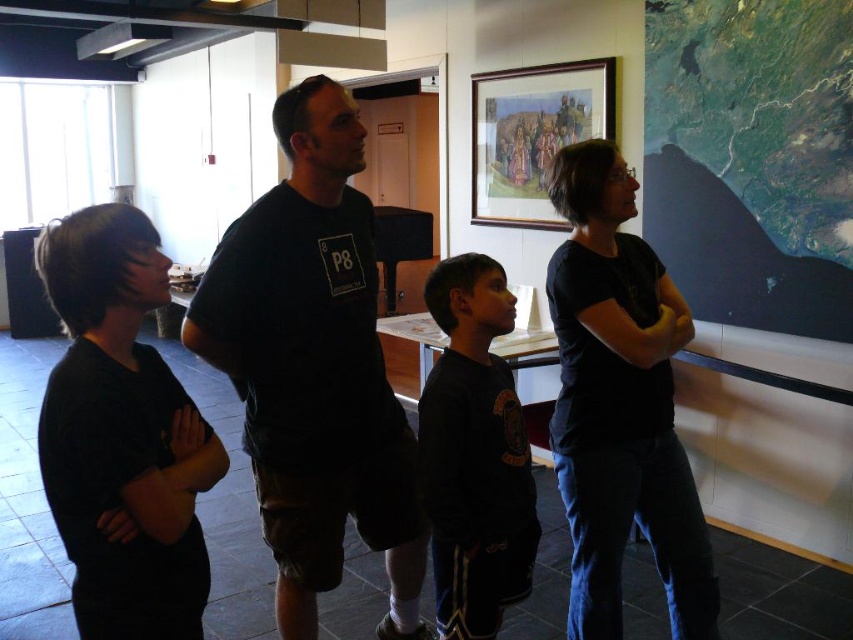
Is point (341, 317) less distant than point (90, 220)?

No, it is behind (90, 220).

Is point (375, 323) positioned behind point (73, 467)?

Yes, point (375, 323) is farther from viewer.

Image resolution: width=853 pixels, height=640 pixels. What are the coordinates of `dark matte t-shirt at center` in the screenshot? It's located at (314, 368).

Does dark matte t-shirt at center appear on the right side of dark matte shirt at center?

Incorrect, dark matte t-shirt at center is not on the right side of dark matte shirt at center.

Is point (410, 541) farther from viewer compared to point (519, 588)?

Yes, point (410, 541) is farther from viewer.

Between point (345, 272) and point (482, 609), which one is positioned in front?

Point (482, 609)

Locate an element on the screen. dark matte t-shirt at center is located at coordinates (314, 368).

Does point (663, 404) come farther from viewer compared to point (438, 448)?

Yes, point (663, 404) is behind point (438, 448).

Locate an element on the screen. This screenshot has width=853, height=640. black matte shirt at right is located at coordinates (619, 403).